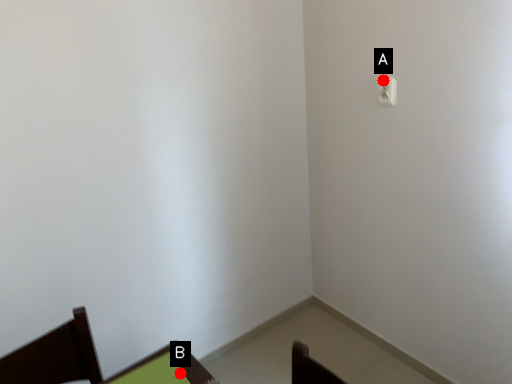
Question: Two points are circled on the image, labeled by A and B beside each circle. Which of the following is the closest to the observer?

Choices:
 (A) A is closer
 (B) B is closer

Answer: (B)